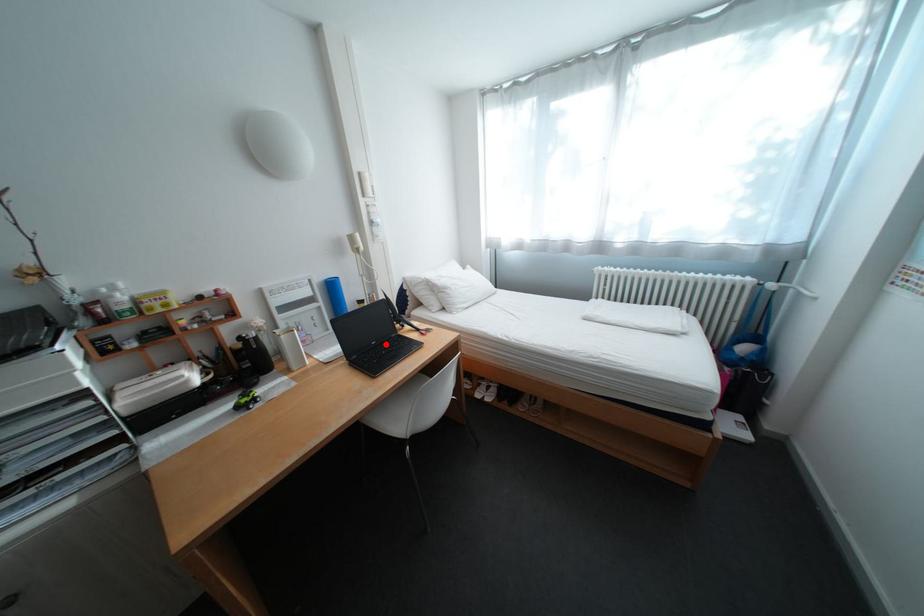
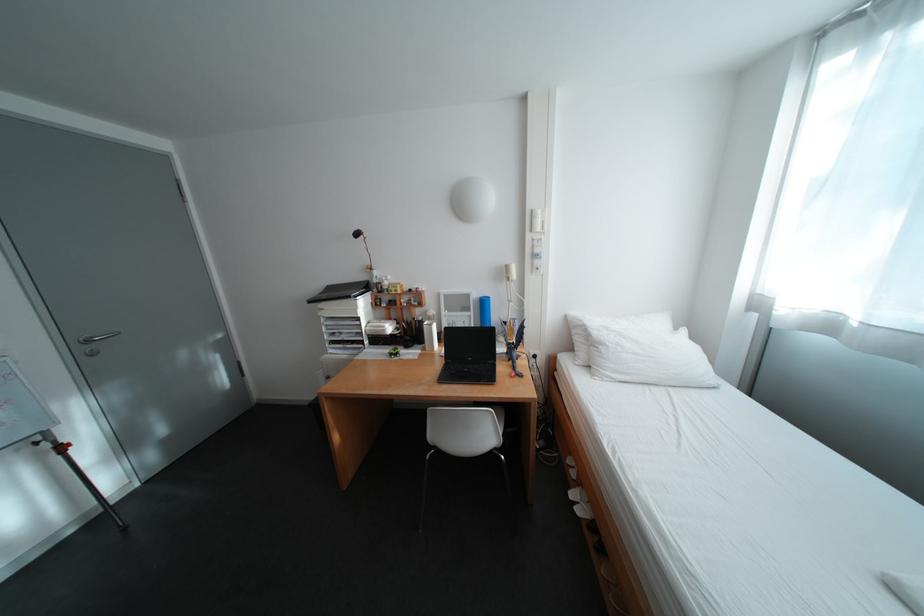
In the second image, find the point that corresponds to the highlighted location in the first image.

(481, 360)